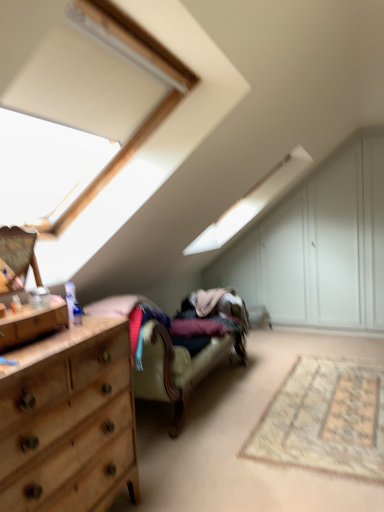
Question: Can we say wooden dresser at left lies outside wooden dresser at left?

Choices:
 (A) yes
 (B) no

Answer: (A)

Question: Is wooden dresser at left bigger than wooden dresser at left?

Choices:
 (A) no
 (B) yes

Answer: (B)

Question: Is wooden dresser at left taller than wooden dresser at left?

Choices:
 (A) no
 (B) yes

Answer: (B)

Question: From the image's perspective, is wooden dresser at left below wooden dresser at left?

Choices:
 (A) no
 (B) yes

Answer: (A)

Question: Can you confirm if wooden dresser at left is positioned to the left of wooden dresser at left?

Choices:
 (A) yes
 (B) no

Answer: (A)

Question: Considering the relative sizes of wooden dresser at left and wooden dresser at left in the image provided, is wooden dresser at left wider than wooden dresser at left?

Choices:
 (A) no
 (B) yes

Answer: (A)

Question: Is white wood dresser at upper right directly adjacent to velvet beige couch at center?

Choices:
 (A) yes
 (B) no

Answer: (B)

Question: Is white wood dresser at upper right turned away from velvet beige couch at center?

Choices:
 (A) yes
 (B) no

Answer: (B)

Question: Is white wood dresser at upper right aimed at velvet beige couch at center?

Choices:
 (A) no
 (B) yes

Answer: (B)

Question: Considering the relative positions of white wood dresser at upper right and velvet beige couch at center in the image provided, is white wood dresser at upper right to the right of velvet beige couch at center from the viewer's perspective?

Choices:
 (A) no
 (B) yes

Answer: (B)

Question: From a real-world perspective, is white wood dresser at upper right under velvet beige couch at center?

Choices:
 (A) no
 (B) yes

Answer: (A)

Question: Is white wood dresser at upper right not near velvet beige couch at center?

Choices:
 (A) no
 (B) yes

Answer: (B)

Question: Is velvet beige couch at center outside of wooden dresser at left?

Choices:
 (A) no
 (B) yes

Answer: (B)